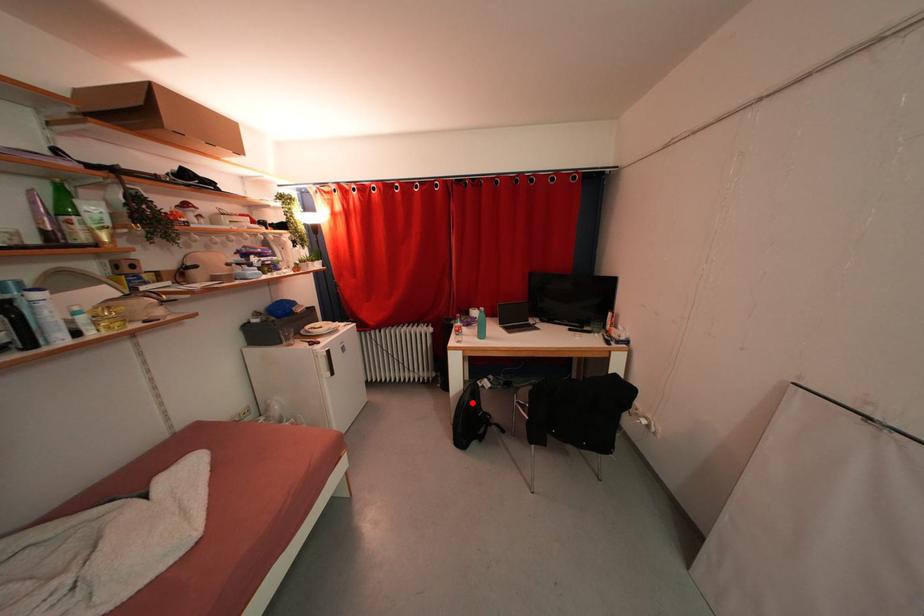
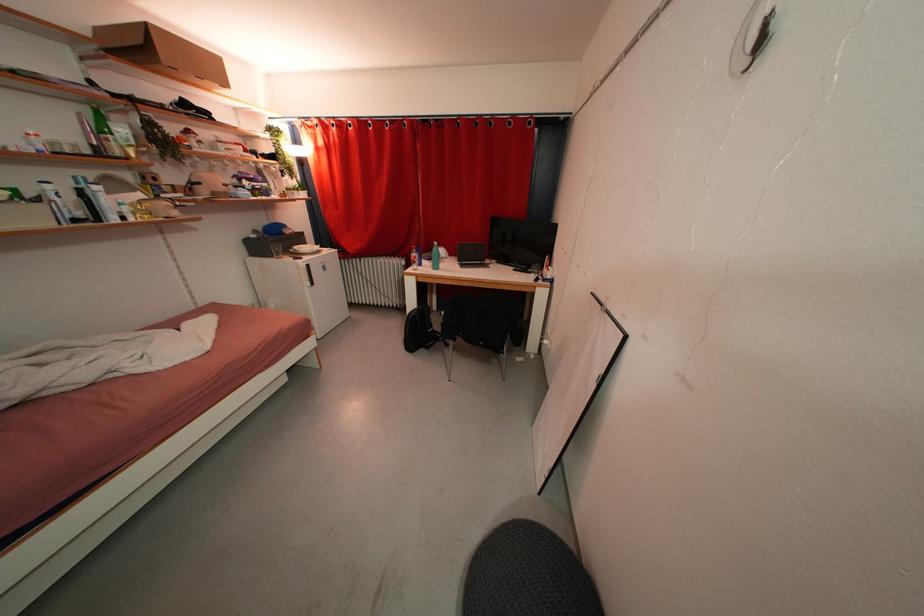
Question: I am providing you with two images of the same scene from different viewpoints. A red point is shown in image1. For the corresponding object point in image2, is it positioned nearer or farther from the camera?

Choices:
 (A) Nearer
 (B) Farther

Answer: (B)